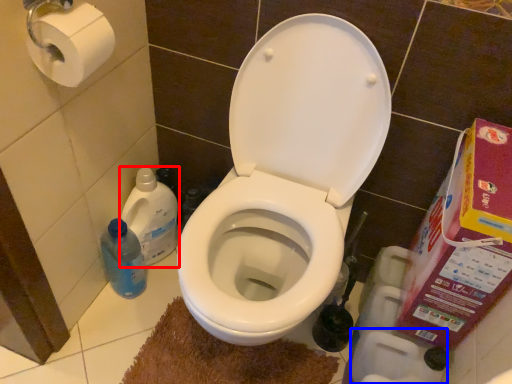
Question: Which object is closer to the camera taking this photo, cleaning product (highlighted by a red box) or toilet paper (highlighted by a blue box)?

Choices:
 (A) cleaning product
 (B) toilet paper

Answer: (B)